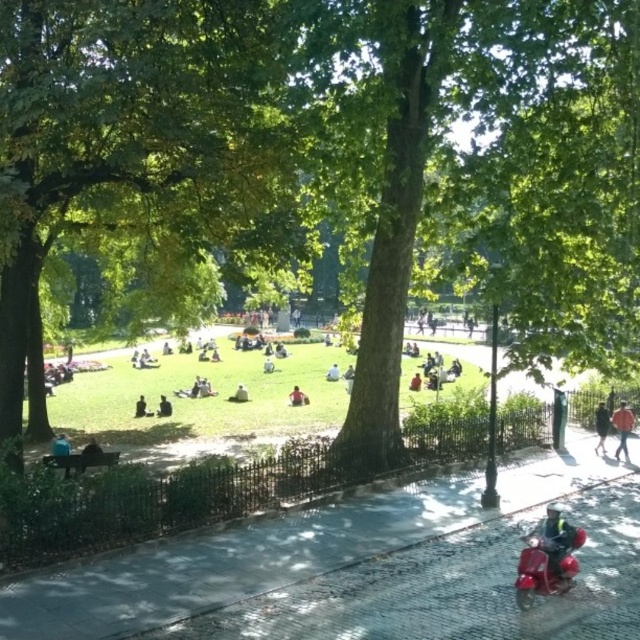
You are planning to carry both the blue fabric bag at lower left and the light brown fabric jacket at center. Which one has a larger width?

The light brown fabric jacket at center has a larger width than the blue fabric bag at lower left.

You are a photographer planning to take a portrait of two people wearing the dark green leather jacket at lower right and the white cotton shirt at center. Since you want to emphasize their clothing, which clothing item should you focus on to highlight its size difference?

The dark green leather jacket at lower right is larger in size than the white cotton shirt at center, so you should focus on the dark green leather jacket at lower right to highlight its larger size.

You are a delivery person carrying a package and need to move from the blue fabric bag at lower left to the light brown fabric jacket at center. The path between them is 19.78 meters. Your delivery cart can only move 20 meters before needing a recharge. Can you make the trip without recharging?

The distance between the blue fabric bag at lower left and the light brown fabric jacket at center is 19.78 meters, which is just under the cart maximum range of 20 meters. Yes, the cart can make the trip without needing a recharge.